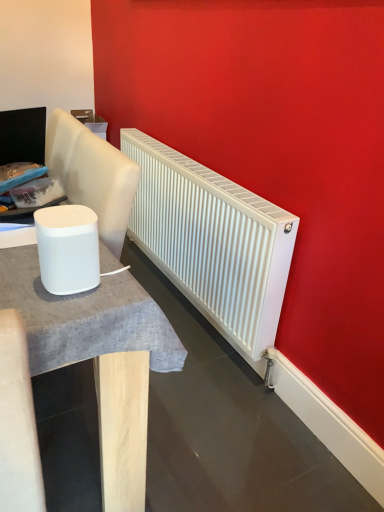
Question: Does point (132, 131) appear closer or farther from the camera than point (41, 269)?

Choices:
 (A) closer
 (B) farther

Answer: (B)

Question: From a real-world perspective, is white matte radiator at center above or below white matte speaker at left?

Choices:
 (A) below
 (B) above

Answer: (A)

Question: Based on their relative distances, which object is nearer to the white matte radiator at center?

Choices:
 (A) white matte table at left
 (B) white matte speaker at left

Answer: (A)

Question: Which object is the farthest from the white matte table at left?

Choices:
 (A) white matte speaker at left
 (B) white matte radiator at center

Answer: (B)